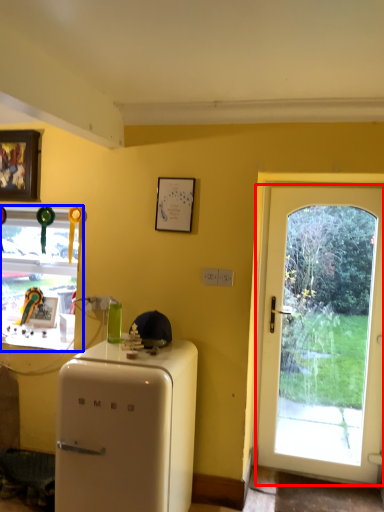
Question: Which point is closer to the camera, door (highlighted by a red box) or window (highlighted by a blue box)?

Choices:
 (A) door
 (B) window

Answer: (A)